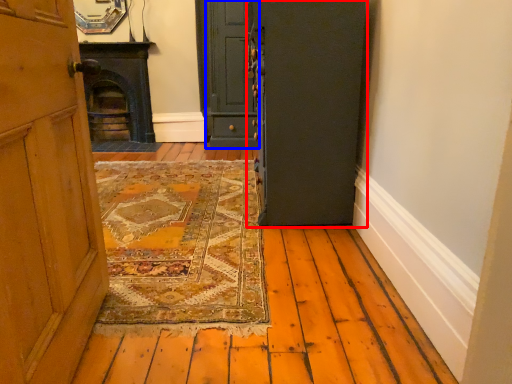
Question: Which object appears closest to the camera in this image, door (highlighted by a red box) or door (highlighted by a blue box)?

Choices:
 (A) door
 (B) door

Answer: (A)